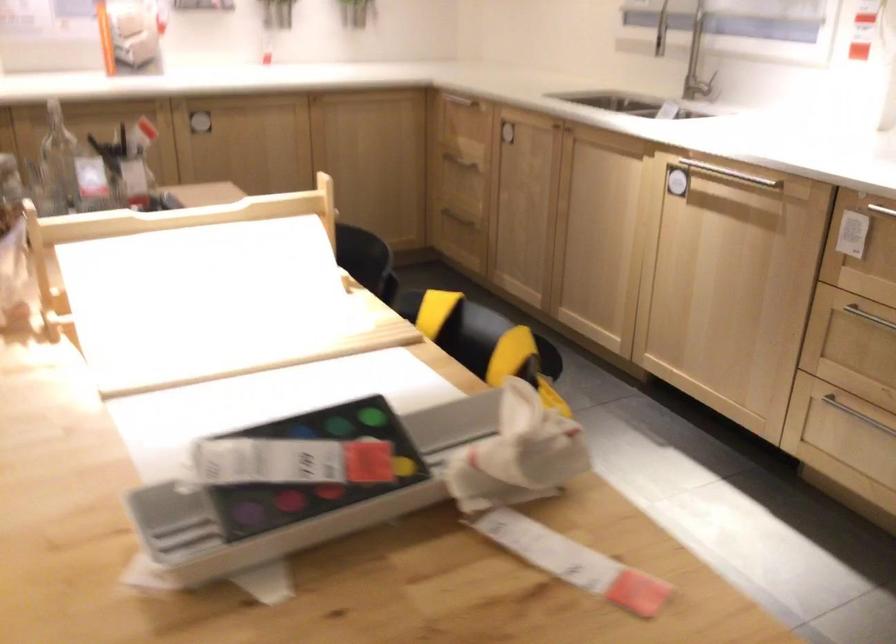
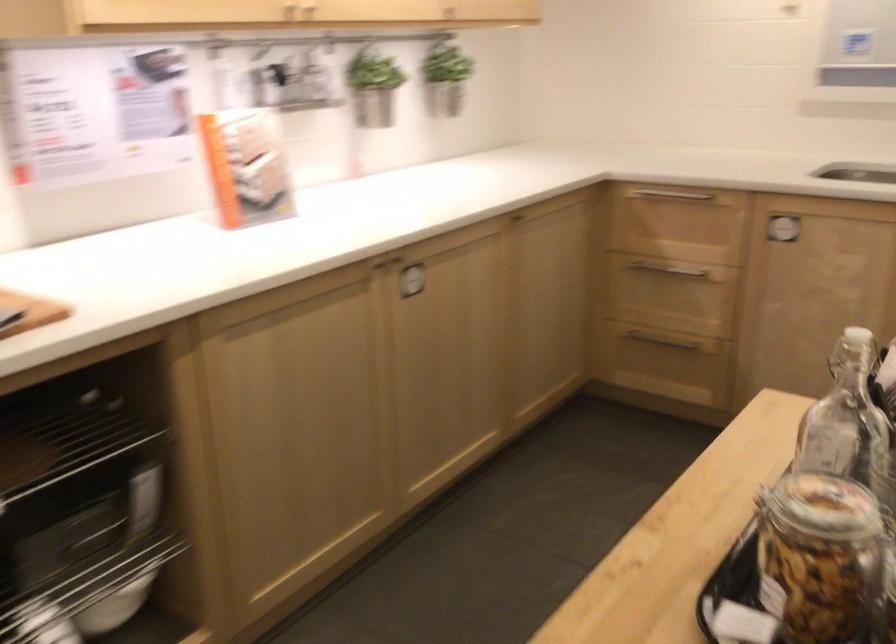
Which direction would the cameraman need to move to produce the second image?

The cameraman walked toward left, forward.